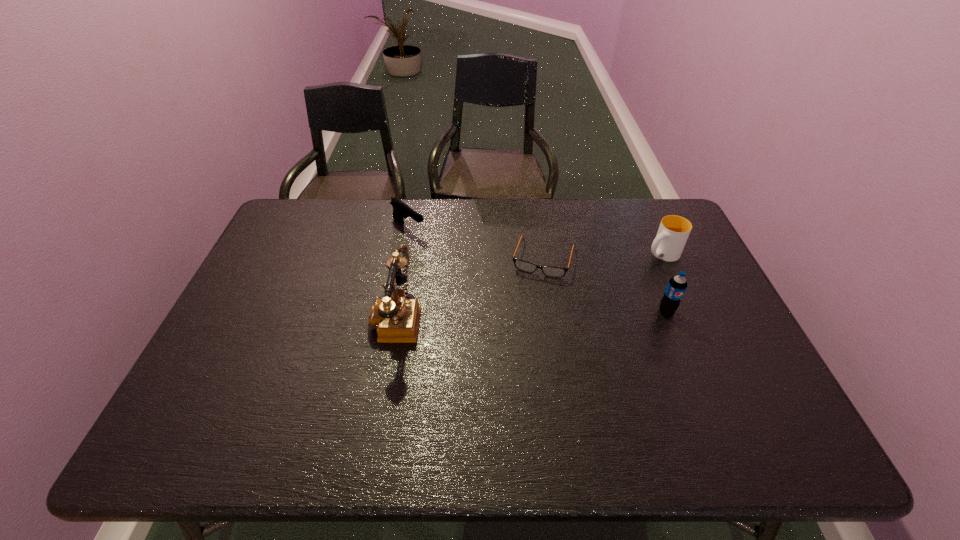
The width and height of the screenshot is (960, 540). Find the location of `telephone`. telephone is located at coordinates (397, 318).

This screenshot has height=540, width=960. Find the location of `the second tallest object`. the second tallest object is located at coordinates pyautogui.click(x=677, y=285).

Identify the location of the third shortest object. (673, 232).

Where is `the fourth tallest object`? The height and width of the screenshot is (540, 960). the fourth tallest object is located at coordinates (400, 210).

Find the location of a particular element. The height and width of the screenshot is (540, 960). the third object from left to right is located at coordinates (550, 271).

You are a GUI agent. You are given a task and a screenshot of the screen. Output one action in this format:
    pyautogui.click(x=<x>, y=<y>)
    Task: Click on the shortest object
    This screenshot has height=540, width=960.
    Given the screenshot: What is the action you would take?
    pyautogui.click(x=550, y=271)

I want to click on free space located 0.280m on the dial number of the tallest object, so click(268, 316).

Image resolution: width=960 pixels, height=540 pixels. Identify the location of vacant space located on the dial number of the tallest object. tap(338, 316).

Find the location of a particular element. The width and height of the screenshot is (960, 540). vacant space situated 0.150m on the dial number of the tallest object is located at coordinates (316, 316).

Locate an element on the screen. This screenshot has height=540, width=960. vacant space located 0.270m on the left of the second tallest object is located at coordinates (560, 312).